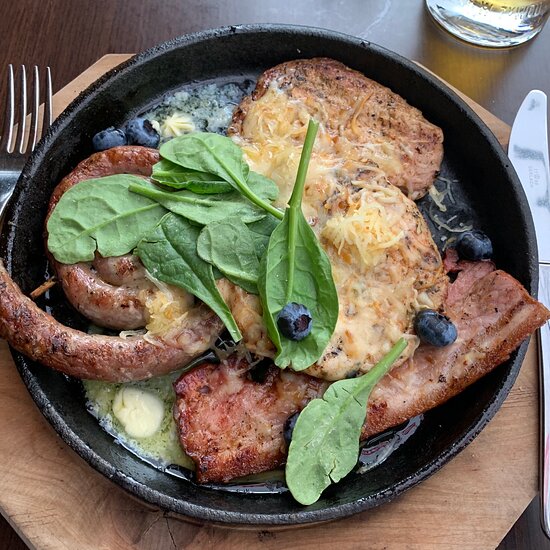
At what (x,y) coordinates should I click in order to perform the action: click on cup. Please return your answer as a coordinate pair (x, y). The width and height of the screenshot is (550, 550). Looking at the image, I should click on (496, 13).